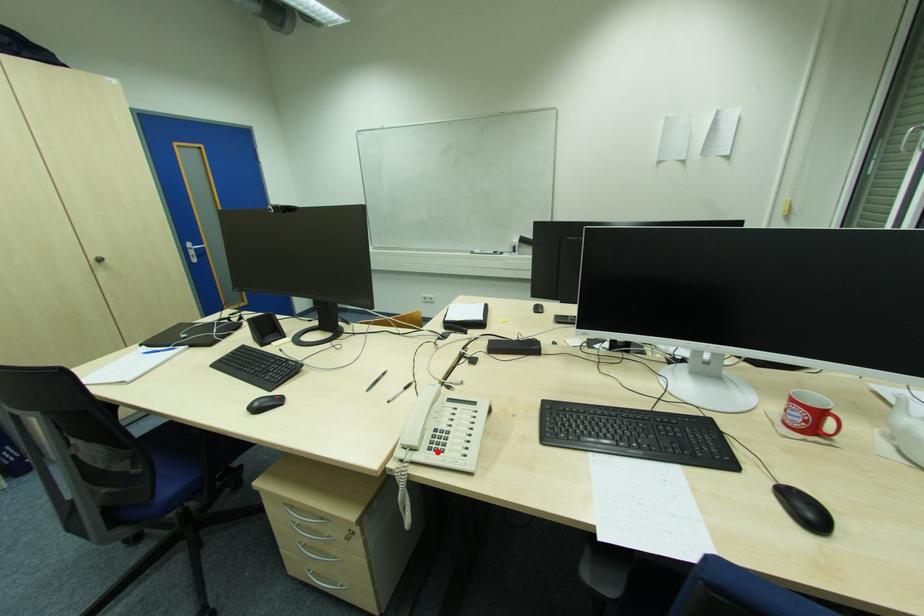
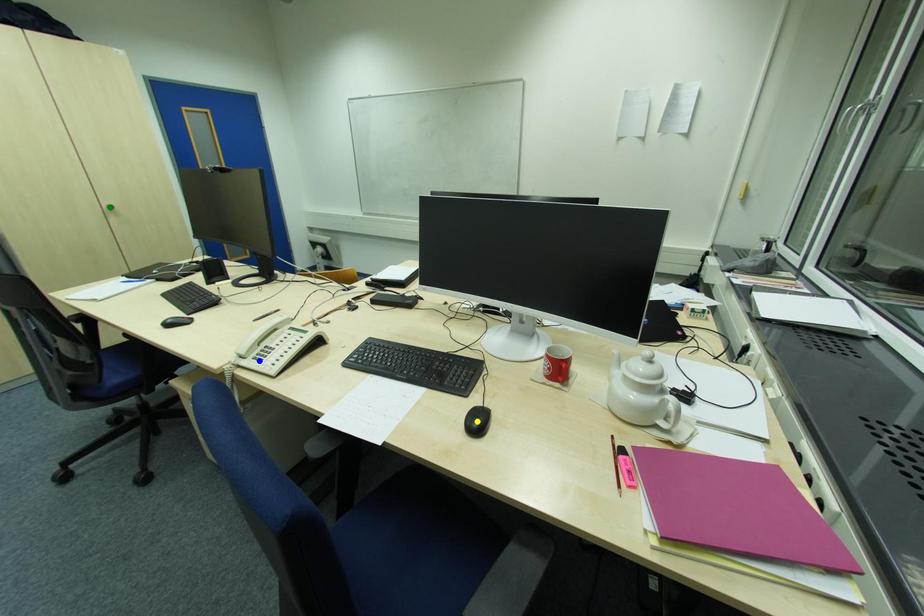
Question: I am providing you with two images of the same scene from different viewpoints. A red point is marked on the first image. You are given multiple points on the second image. Which mark in image 2 goes with the point in image 1?

Choices:
 (A) blue point
 (B) green point
 (C) yellow point

Answer: (A)